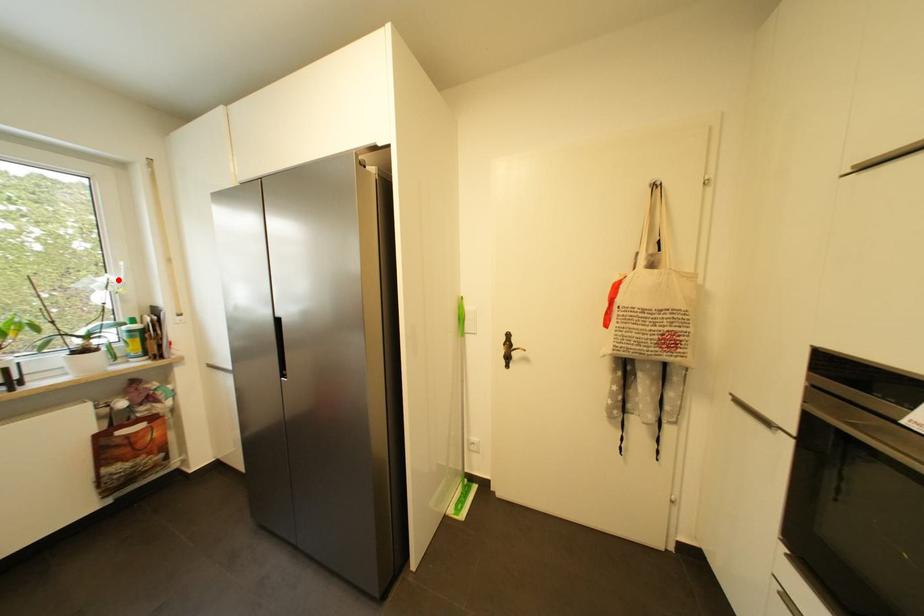
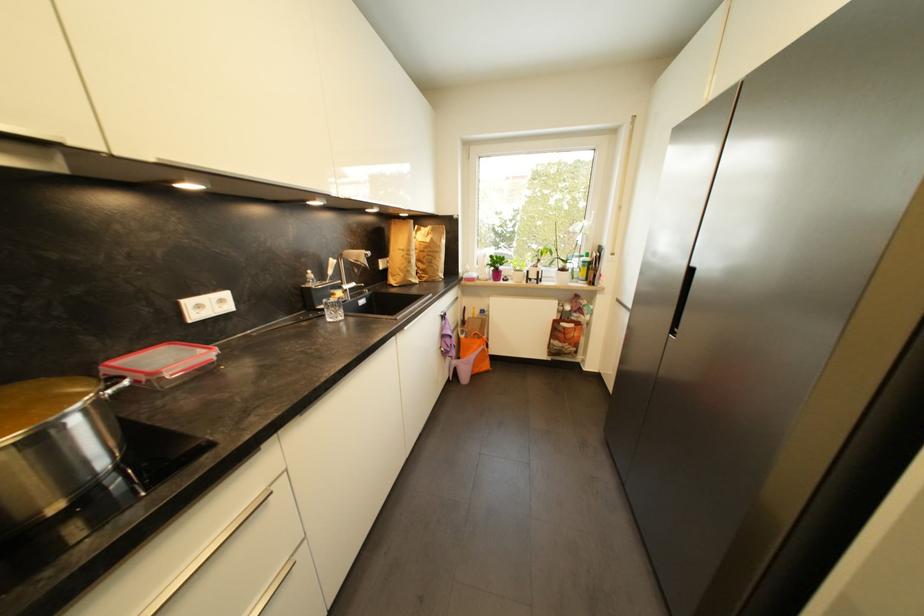
Question: I am providing you with two images of the same scene from different viewpoints. A red point is shown in image1. For the corresponding object point in image2, is it positioned nearer or farther from the camera?

Choices:
 (A) Nearer
 (B) Farther

Answer: (A)